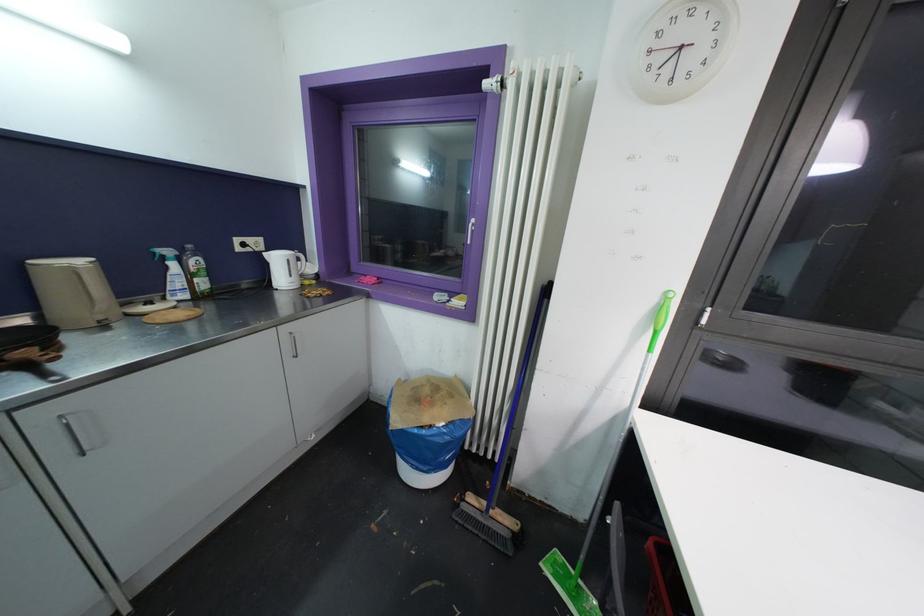
This screenshot has width=924, height=616. What do you see at coordinates (516, 232) in the screenshot?
I see `a radiator control knob` at bounding box center [516, 232].